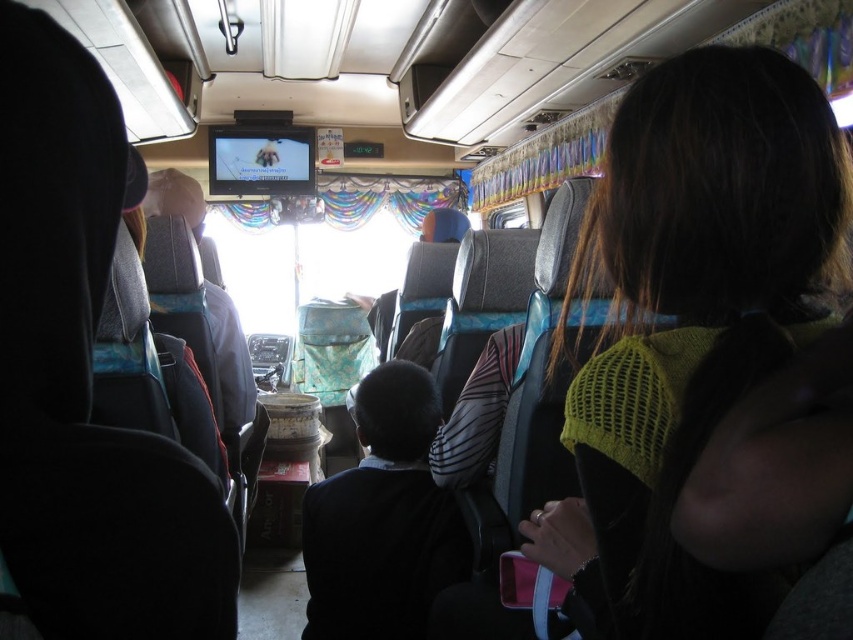
Question: Which of the following is the farthest from the observer?

Choices:
 (A) (733, 152)
 (B) (358, 632)

Answer: (B)

Question: In this image, where is knitted yellow sweater at right located relative to dark blue fabric at center?

Choices:
 (A) left
 (B) right

Answer: (B)

Question: In this image, where is knitted yellow sweater at right located relative to dark blue fabric at center?

Choices:
 (A) above
 (B) below

Answer: (A)

Question: In this image, where is knitted yellow sweater at right located relative to dark blue fabric at center?

Choices:
 (A) right
 (B) left

Answer: (A)

Question: Among these objects, which one is farthest from the camera?

Choices:
 (A) knitted yellow sweater at right
 (B) dark blue fabric at center

Answer: (B)